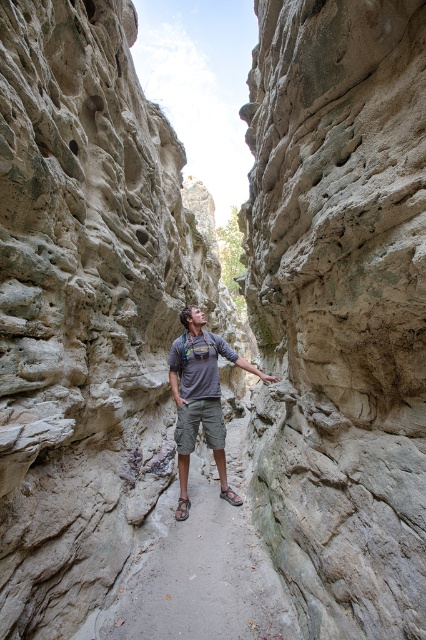
Is gray rough rock at center shorter than gray sand at center?

No, gray rough rock at center is not shorter than gray sand at center.

Find the location of `gray rough rock at center`. gray rough rock at center is located at coordinates (340, 307).

Can you confirm if gray sand at center is positioned to the left of gray fabric shirt at center?

Indeed, gray sand at center is positioned on the left side of gray fabric shirt at center.

Does point (216, 625) come farther from viewer compared to point (178, 433)?

No, (216, 625) is closer to viewer.

Who is more forward, (180, 564) or (227, 349)?

Point (180, 564) is more forward.

Identify the location of gray sand at center. (199, 566).

Between gray rough rock at center and gray fabric shirt at center, which one is positioned higher?

gray rough rock at center is higher up.

Measure the distance between gray rough rock at center and camera.

A distance of 8.45 feet exists between gray rough rock at center and camera.

Identify the location of gray rough rock at center. (340, 307).